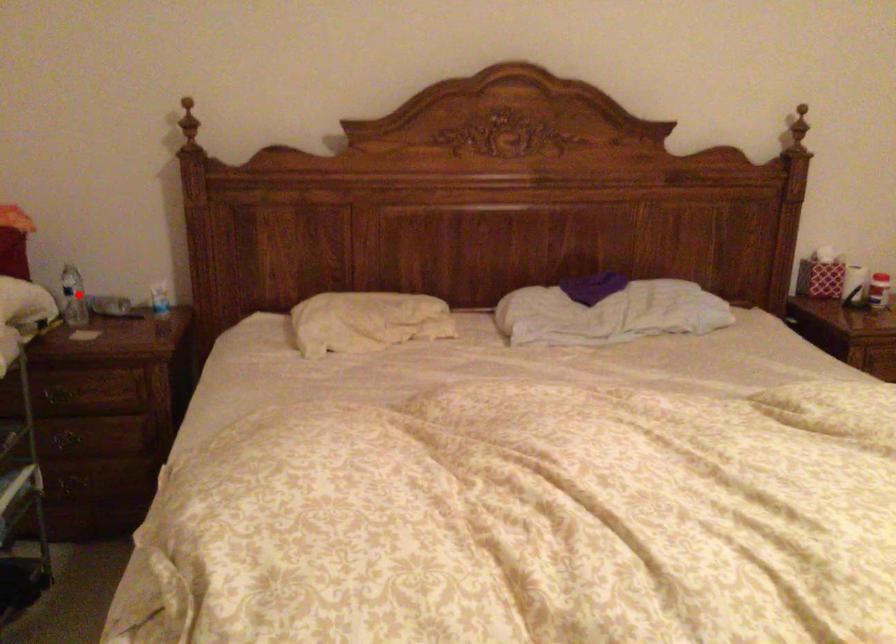
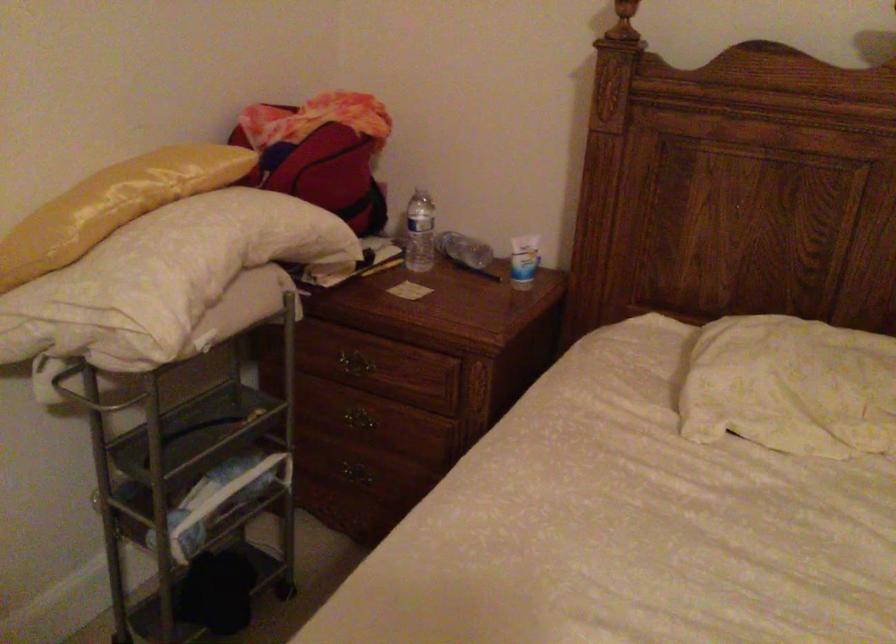
Question: I am providing you with two images of the same scene from different viewpoints. Image1 has a red point marked. In image2, the corresponding 3D location appears at what relative position? Reply with the corresponding letter.

Choices:
 (A) Closer
 (B) Farther

Answer: (A)